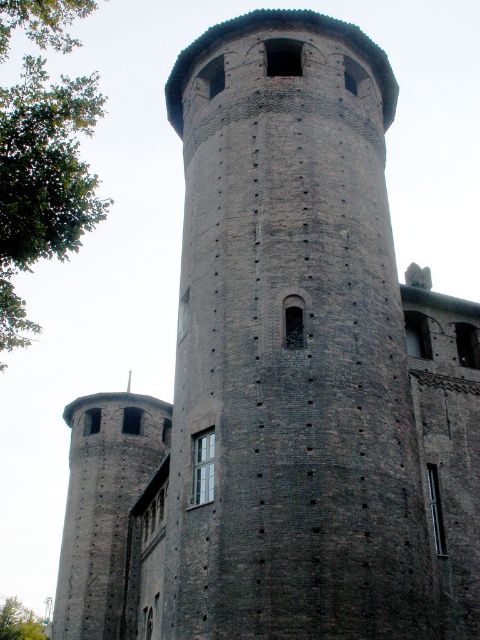
Can you confirm if green leafy tree at left is positioned above green leafy tree at lower left?

Yes, green leafy tree at left is above green leafy tree at lower left.

Which is more to the left, green leafy tree at left or green leafy tree at lower left?

green leafy tree at lower left is more to the left.

This screenshot has height=640, width=480. Describe the element at coordinates (43, 180) in the screenshot. I see `green leafy tree at left` at that location.

What are the coordinates of `green leafy tree at left` in the screenshot? It's located at (43, 180).